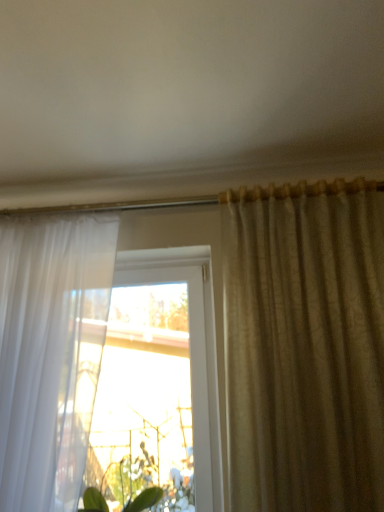
Question: Considering the relative positions of green leafy plant at lower center and transparent glass window at center in the image provided, is green leafy plant at lower center in front of transparent glass window at center?

Choices:
 (A) yes
 (B) no

Answer: (A)

Question: Is green leafy plant at lower center behind transparent glass window at center?

Choices:
 (A) no
 (B) yes

Answer: (A)

Question: From a real-world perspective, is green leafy plant at lower center on transparent glass window at center?

Choices:
 (A) no
 (B) yes

Answer: (A)

Question: Is green leafy plant at lower center positioned with its back to transparent glass window at center?

Choices:
 (A) no
 (B) yes

Answer: (B)

Question: Is the surface of green leafy plant at lower center in direct contact with transparent glass window at center?

Choices:
 (A) yes
 (B) no

Answer: (B)

Question: From the image's perspective, is white sheer curtain at left, which is counted as the second curtain, starting from the right, located above or below transparent glass window at center?

Choices:
 (A) below
 (B) above

Answer: (B)

Question: In terms of height, does white sheer curtain at left, the first curtain in the left-to-right sequence, look taller or shorter compared to transparent glass window at center?

Choices:
 (A) short
 (B) tall

Answer: (B)

Question: Which is correct: white sheer curtain at left, the first curtain in the left-to-right sequence, is inside transparent glass window at center, or outside of it?

Choices:
 (A) outside
 (B) inside

Answer: (A)

Question: From a real-world perspective, relative to transparent glass window at center, is white sheer curtain at left, which is counted as the second curtain, starting from the right, vertically above or below?

Choices:
 (A) above
 (B) below

Answer: (A)

Question: Does point (115, 465) appear closer or farther from the camera than point (8, 443)?

Choices:
 (A) closer
 (B) farther

Answer: (B)

Question: Which is correct: green leafy plant at lower center is inside white sheer curtain at left, the first curtain in the left-to-right sequence, or outside of it?

Choices:
 (A) inside
 (B) outside

Answer: (B)

Question: From the image's perspective, relative to white sheer curtain at left, which is counted as the second curtain, starting from the right, is green leafy plant at lower center above or below?

Choices:
 (A) above
 (B) below

Answer: (B)

Question: Is green leafy plant at lower center in front of or behind white sheer curtain at left, the first curtain in the left-to-right sequence, in the image?

Choices:
 (A) front
 (B) behind

Answer: (B)

Question: Choose the correct answer: Is satin beige curtain at right, acting as the second curtain starting from the left, inside transparent glass window at center or outside it?

Choices:
 (A) inside
 (B) outside

Answer: (B)

Question: From a real-world perspective, is satin beige curtain at right, the 1th curtain positioned from the right, physically located above or below transparent glass window at center?

Choices:
 (A) below
 (B) above

Answer: (B)